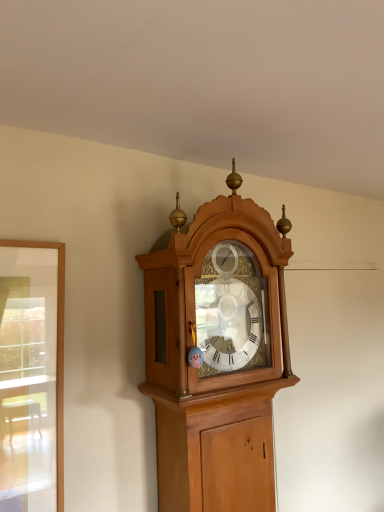
The height and width of the screenshot is (512, 384). Identify the location of wooden grandfather clock at center. (217, 355).

Describe the element at coordinates (217, 355) in the screenshot. This screenshot has height=512, width=384. I see `wooden grandfather clock at center` at that location.

At what (x,y) coordinates should I click in order to perform the action: click on wooden grandfather clock at center. Please return your answer as a coordinate pair (x, y). The image size is (384, 512). Looking at the image, I should click on (217, 355).